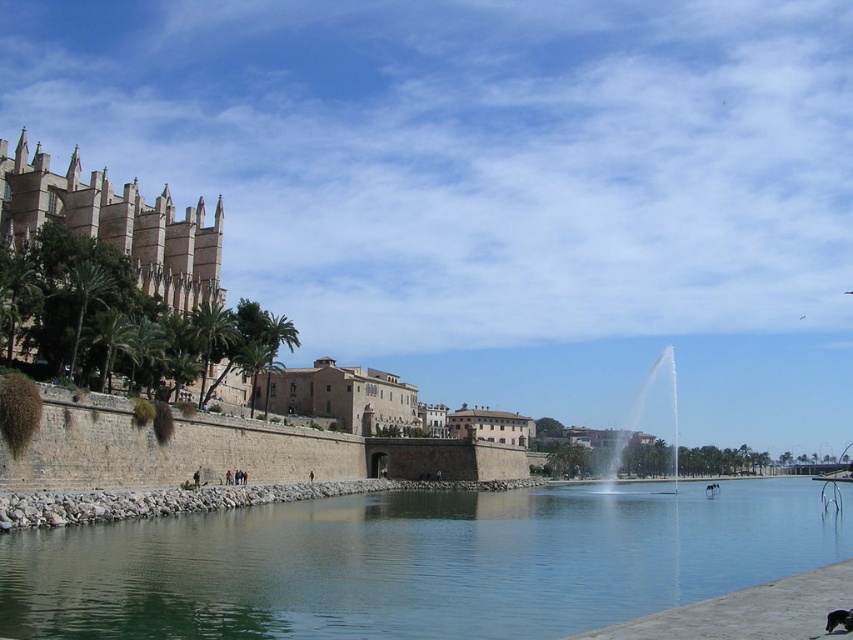
Question: Among these objects, which one is nearest to the camera?

Choices:
 (A) clear water at center
 (B) brown stone building at center

Answer: (A)

Question: Does clear water at center have a larger size compared to brown stone building at center?

Choices:
 (A) yes
 (B) no

Answer: (A)

Question: Does clear water at center have a greater width compared to brown stone building at center?

Choices:
 (A) yes
 (B) no

Answer: (A)

Question: In this image, where is clear water at center located relative to brown stone building at center?

Choices:
 (A) below
 (B) above

Answer: (A)

Question: Among these points, which one is nearest to the camera?

Choices:
 (A) (378, 388)
 (B) (566, 579)

Answer: (B)